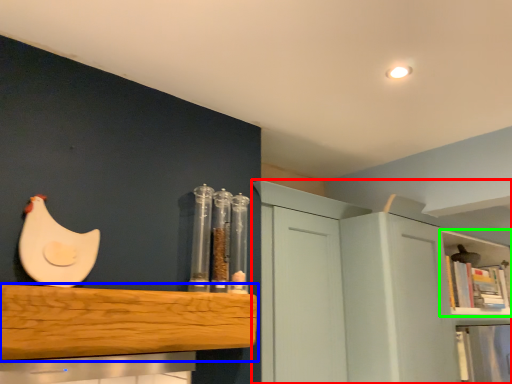
Question: Which object is the closest to the cabinetry (highlighted by a red box)? Choose among these: shelf (highlighted by a blue box) or shelf (highlighted by a green box).

Choices:
 (A) shelf
 (B) shelf

Answer: (A)